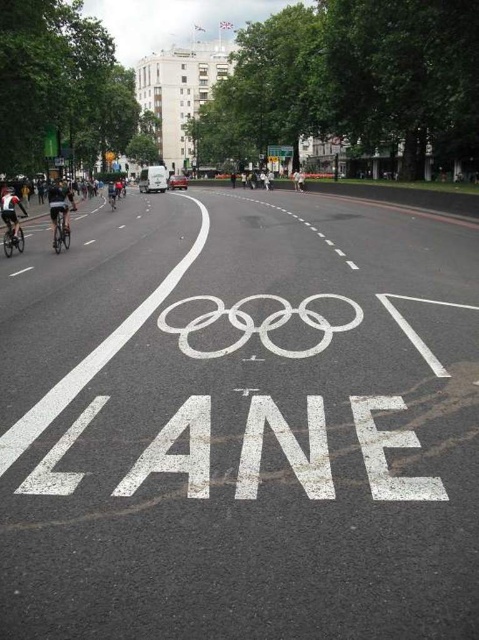
Question: Which object is the farthest from the silver metallic bicycle at left?

Choices:
 (A) white asphalt bike lane at center
 (B) white cycling jersey at left
 (C) shiny silver bicycle at left
 (D) dark blue jersey at left

Answer: (A)

Question: Can you confirm if white cycling jersey at left is positioned above white plastic sign at center?

Choices:
 (A) no
 (B) yes

Answer: (A)

Question: Considering the relative positions of silver metallic bicycle at left and white plastic sign at center in the image provided, where is silver metallic bicycle at left located with respect to white plastic sign at center?

Choices:
 (A) left
 (B) right

Answer: (A)

Question: Which point is closer to the camera?

Choices:
 (A) (443, 380)
 (B) (63, 236)
 (C) (282, 145)

Answer: (A)

Question: Considering the relative positions of silver metallic bicycle at left and shiny silver bicycle at left in the image provided, where is silver metallic bicycle at left located with respect to shiny silver bicycle at left?

Choices:
 (A) right
 (B) left

Answer: (A)

Question: Which of these objects is positioned closest to the shiny silver bicycle at left?

Choices:
 (A) silver metallic bicycle at left
 (B) dark blue jersey at left

Answer: (A)